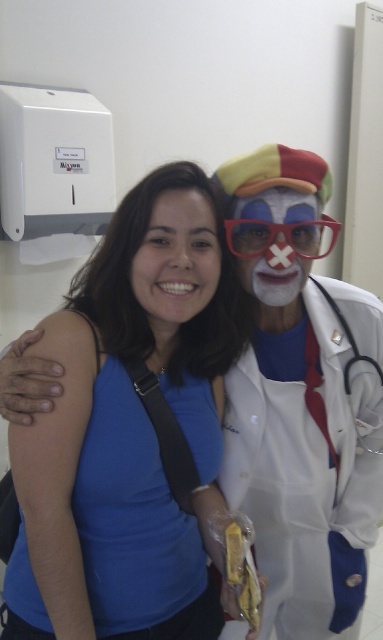
You are a photographer setting up for a photo shoot. You have two props, a blue matte shirt at center and transparent plastic goggles at center. The client wants to know which prop is positioned to the right side. Which one should you point out?

The transparent plastic goggles at center are positioned to the right of the blue matte shirt at center, so you should point out the transparent plastic goggles at center.

You are a photographer trying to capture a closeup shot of both the blue matte shirt at center and the matte clown face at center in the image. The camera you are using has a maximum focus range of 12 inches. Can you fit both subjects within the focus range?

The blue matte shirt at center and the matte clown face at center are 11.92 inches apart, so yes, they can both be captured within the camera focus range of 12 inches.

You are a photographer setting up for a portrait. You have two main subjects in the frame, the blue matte shirt at center and the matte clown face at center. Which subject should you focus on if you want to emphasize the taller object in the scene?

The blue matte shirt at center has a greater height compared to the matte clown face at center, so you should focus on the blue matte shirt at center to emphasize the taller object in the scene.